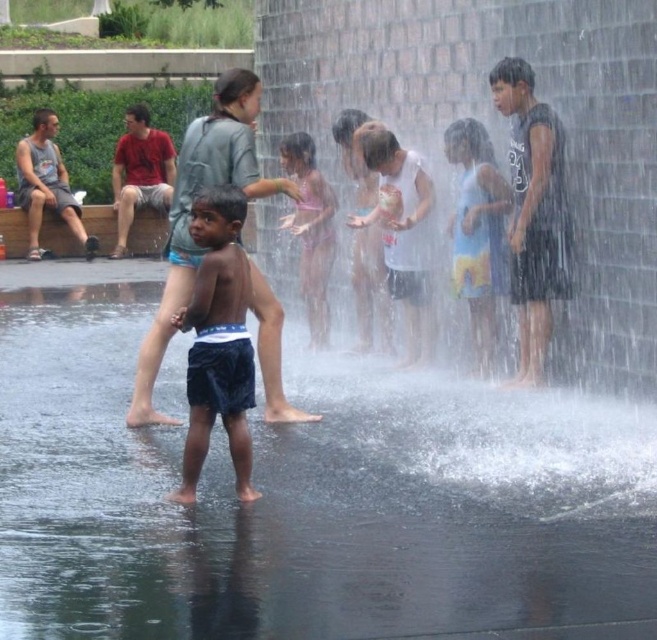
Question: Among these objects, which one is farthest from the camera?

Choices:
 (A) dark blue shorts at center
 (B) clear water at center
 (C) white matte shirt at center
 (D) pink bikini at center

Answer: (D)

Question: Considering the real-world distances, which object is farthest from the pink bikini at center?

Choices:
 (A) gray tank top at left
 (B) white matte shirt at center
 (C) dark blue shorts at center
 (D) clear water at center

Answer: (A)

Question: Can you confirm if black matte shirt at right is positioned below pink bikini at center?

Choices:
 (A) yes
 (B) no

Answer: (A)

Question: Can you confirm if black matte shirt at right is smaller than pink bikini at center?

Choices:
 (A) yes
 (B) no

Answer: (A)

Question: Is light blue tie-dye shorts at center smaller than gray tank top at left?

Choices:
 (A) yes
 (B) no

Answer: (A)

Question: Which object appears farthest from the camera in this image?

Choices:
 (A) dark blue shorts at center
 (B) white matte shirt at center

Answer: (B)